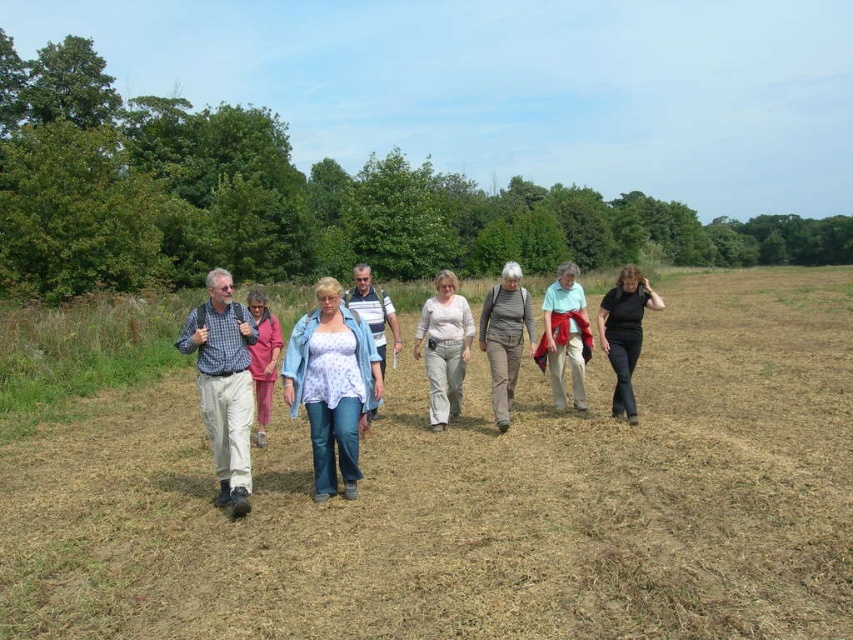
You are a photographer trying to capture a clear photo of both the gray cotton pants at center and the light blue cotton shirt at center. Since you want both subjects in focus, which one should you focus on first to ensure the other is also in focus?

You should focus on the gray cotton pants at center first because it is closer to the viewer than the light blue cotton shirt at center. By focusing on the closer object, the farther one will also be in focus due to the depth of field.

You are a photographer trying to capture a photo of the group. You notice the light blue cotton shirt at center and the black matte pants at lower right. Which object should you focus on to ensure it appears larger in the photo?

The black matte pants at lower right should be focused on to appear larger in the photo because it is larger in size compared to the light blue cotton shirt at center.

Based on the scene description, where is the gray cotton pants at center located in terms of coordinates?

The gray cotton pants at center is located at coordinates point (505, 337).